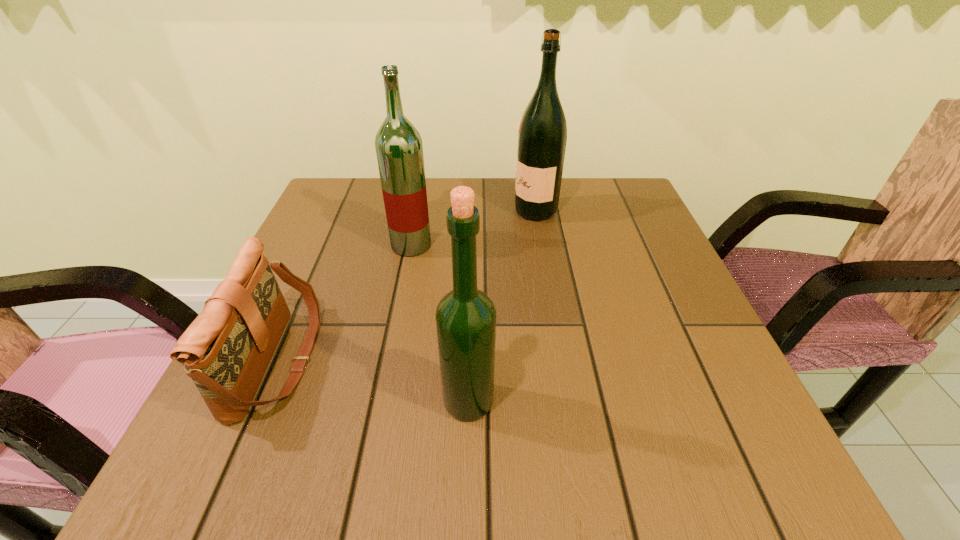
Locate an element on the screen. vacant space located on the front-facing side of the rightmost object is located at coordinates (362, 211).

The image size is (960, 540). What are the coordinates of `vacant space located on the front of the second farthest liquor` in the screenshot? It's located at (398, 312).

Locate an element on the screen. free space located on the right of the nearest liquor is located at coordinates (712, 401).

Locate an element on the screen. The image size is (960, 540). free spot located 0.260m on the front-facing side of the shortest object is located at coordinates (460, 361).

In order to click on object located in the far edge section of the desktop in this screenshot , I will do `click(542, 136)`.

This screenshot has width=960, height=540. In order to click on object present at the near edge in this screenshot , I will do `click(226, 350)`.

Image resolution: width=960 pixels, height=540 pixels. I want to click on object located in the left edge section of the desktop, so click(226, 350).

You are a GUI agent. You are given a task and a screenshot of the screen. Output one action in this format:
    pyautogui.click(x=<x>, y=<y>)
    Task: Click on the object that is at the near left corner
    Image resolution: width=960 pixels, height=540 pixels.
    Given the screenshot: What is the action you would take?
    pyautogui.click(x=226, y=350)

I want to click on vacant space at the far edge of the desktop, so coord(481,206).

Where is `free space at the near edge`? free space at the near edge is located at coordinates (466, 458).